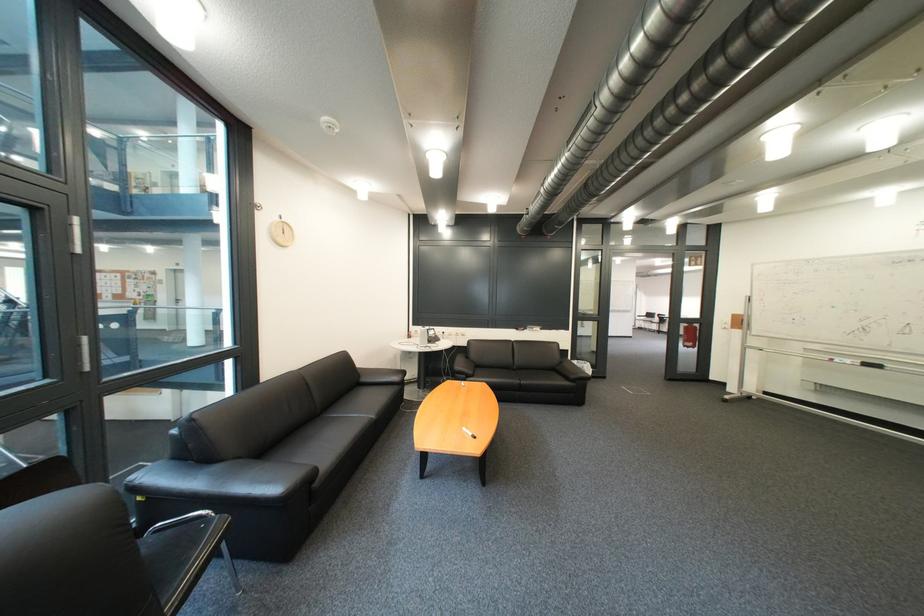
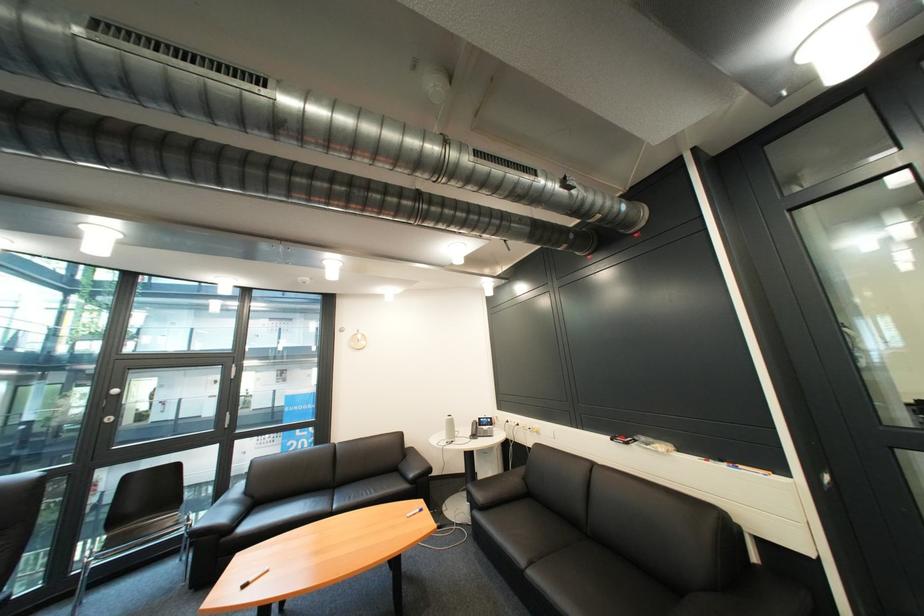
Locate, in the second image, the point that corresponds to the point at 475,338 in the first image.

(549, 435)